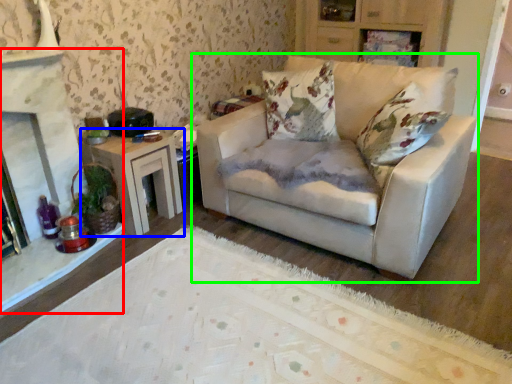
Question: Based on their relative distances, which object is nearer to fireplace (highlighted by a red box)? Choose from table (highlighted by a blue box) and studio couch (highlighted by a green box).

Choices:
 (A) table
 (B) studio couch

Answer: (A)